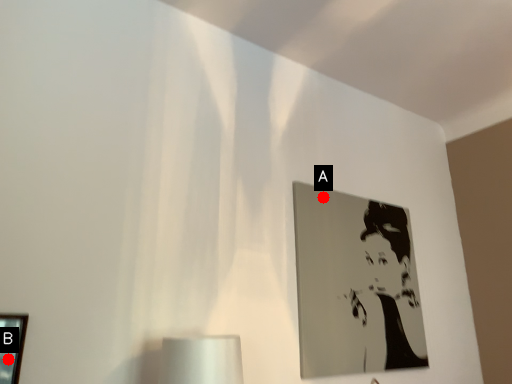
Question: Two points are circled on the image, labeled by A and B beside each circle. Among these points, which one is nearest to the camera?

Choices:
 (A) A is closer
 (B) B is closer

Answer: (B)